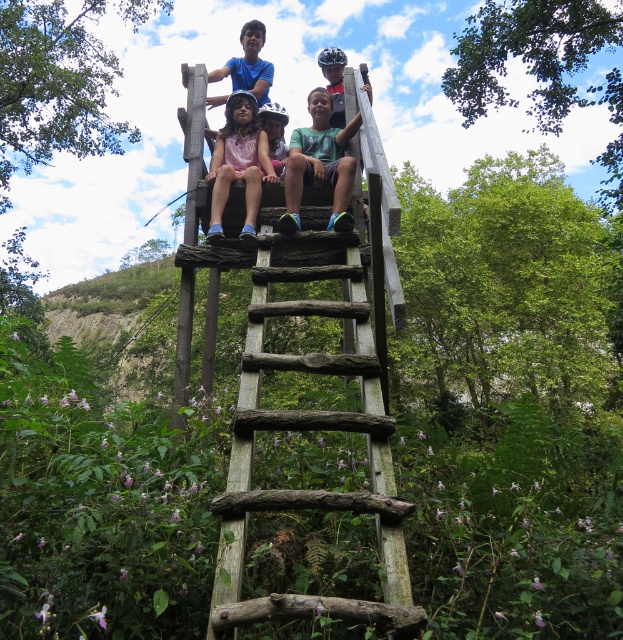
How far apart are weathered wood ladder at center and green matte shirt at center?

36.93 inches

Does weathered wood ladder at center have a lesser height compared to green matte shirt at center?

In fact, weathered wood ladder at center may be taller than green matte shirt at center.

This screenshot has height=640, width=623. In order to click on weathered wood ladder at center in this screenshot , I will do `click(305, 417)`.

At what (x,y) coordinates should I click in order to perform the action: click on weathered wood ladder at center. Please return your answer as a coordinate pair (x, y). The height and width of the screenshot is (640, 623). Looking at the image, I should click on (305, 417).

Is green matte shirt at center further to the viewer compared to pink fabric dress at center?

No, it is in front of pink fabric dress at center.

Is green matte shirt at center in front of pink fabric dress at center?

Yes, it is.

Between point (343, 145) and point (235, 132), which one is positioned in front?

Positioned in front is point (343, 145).

You are a GUI agent. You are given a task and a screenshot of the screen. Output one action in this format:
    pyautogui.click(x=<x>, y=<y>)
    Task: Click on the green matte shirt at center
    Image resolution: width=623 pixels, height=640 pixels.
    Given the screenshot: What is the action you would take?
    pyautogui.click(x=320, y=163)

Is weathered wood ladder at center closer to the viewer compared to pink fabric dress at center?

Yes, it is.

Between weathered wood ladder at center and pink fabric dress at center, which one appears on the left side from the viewer's perspective?

From the viewer's perspective, pink fabric dress at center appears more on the left side.

You are a GUI agent. You are given a task and a screenshot of the screen. Output one action in this format:
    pyautogui.click(x=<x>, y=<y>)
    Task: Click on the weathered wood ladder at center
    
    Given the screenshot: What is the action you would take?
    pyautogui.click(x=305, y=417)